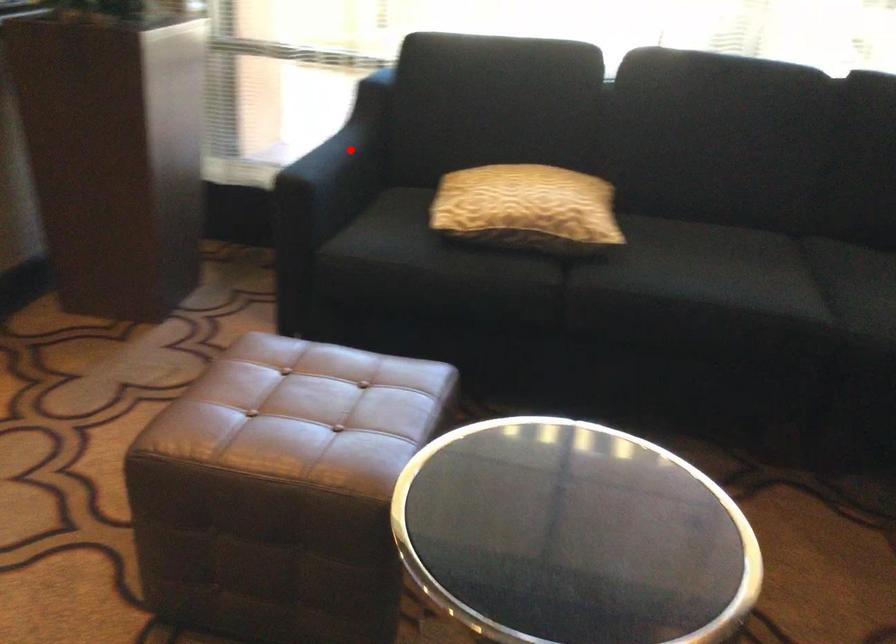
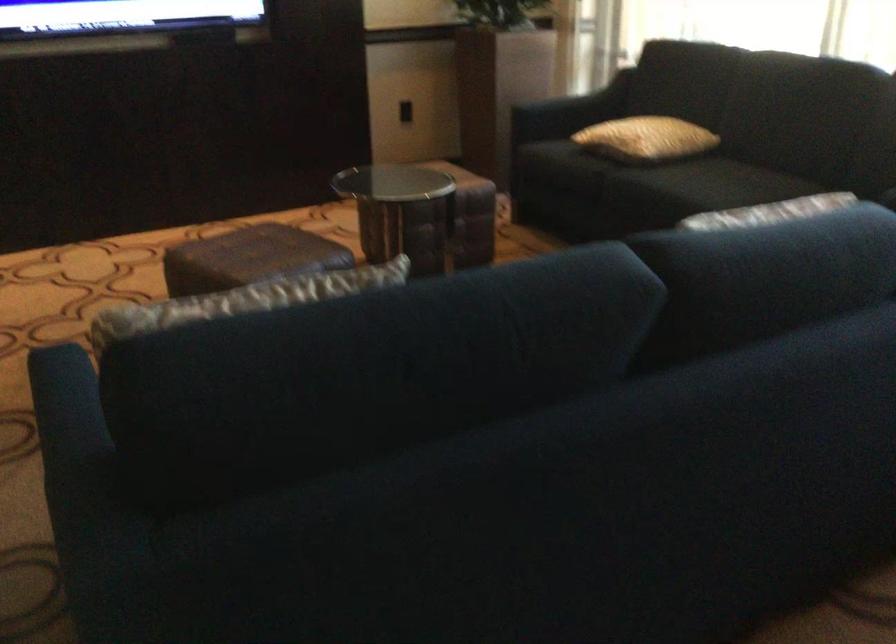
Question: I am providing you with two images of the same scene from different viewpoints. A red point is marked on the first image. Is the red point's position out of view in image 2?

Choices:
 (A) Yes
 (B) No

Answer: (B)